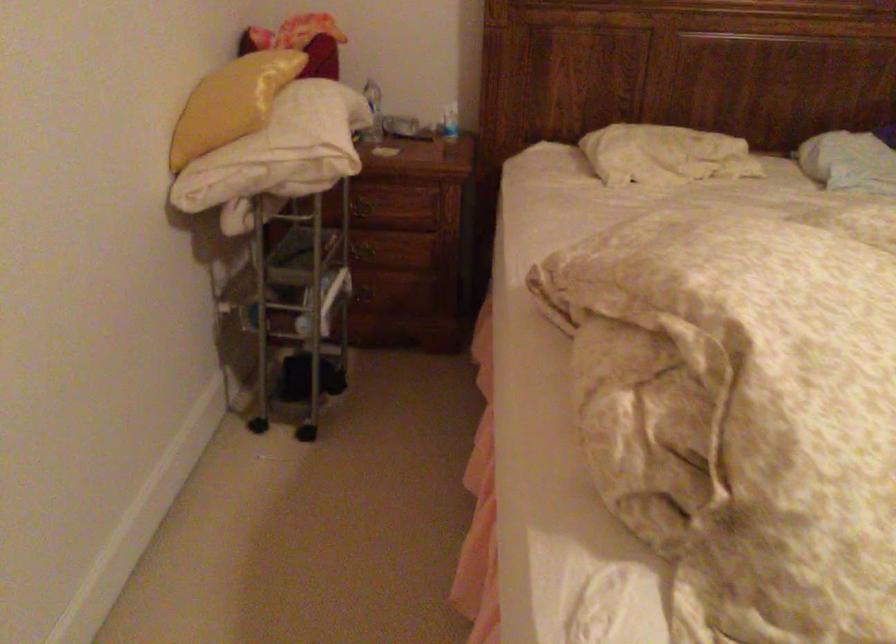
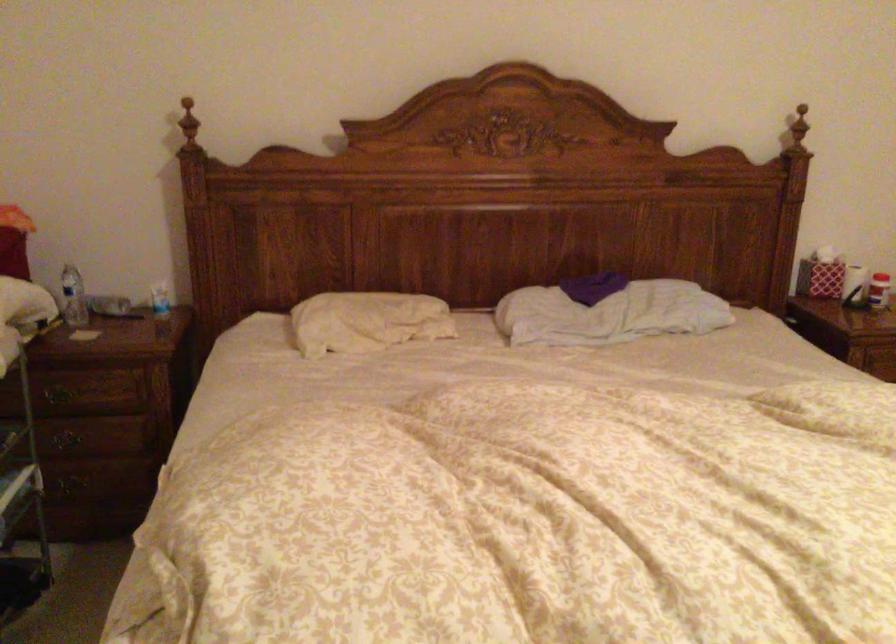
Question: Which direction would the cameraman need to move to produce the second image? Reply with the corresponding letter.

Choices:
 (A) Left
 (B) Right
 (C) Forward
 (D) Backward

Answer: (B)